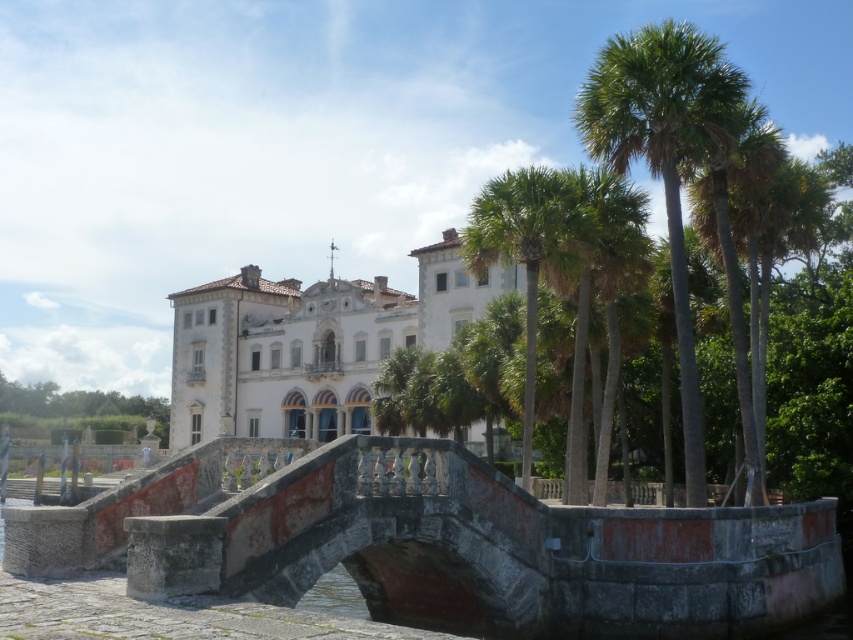
Is rustic stone bridge at center positioned at the back of white stone palace at center?

No.

Describe the element at coordinates (437, 544) in the screenshot. I see `rustic stone bridge at center` at that location.

The width and height of the screenshot is (853, 640). What do you see at coordinates (437, 544) in the screenshot?
I see `rustic stone bridge at center` at bounding box center [437, 544].

Where is `rustic stone bridge at center`? This screenshot has height=640, width=853. rustic stone bridge at center is located at coordinates (437, 544).

Consider the image. Can you confirm if rustic stone bridge at center is wider than green leafy palm trees at right?

No.

Does rustic stone bridge at center come in front of green leafy palm trees at right?

Yes, rustic stone bridge at center is closer to the viewer.

The width and height of the screenshot is (853, 640). Describe the element at coordinates (437, 544) in the screenshot. I see `rustic stone bridge at center` at that location.

Image resolution: width=853 pixels, height=640 pixels. Identify the location of rustic stone bridge at center. (437, 544).

Does point (317, 388) lie in front of point (694, 492)?

No, it is behind (694, 492).

Is white stone palace at center further to camera compared to green leafy palm trees at right?

Yes.

What do you see at coordinates (281, 355) in the screenshot?
I see `white stone palace at center` at bounding box center [281, 355].

The image size is (853, 640). In order to click on white stone palace at center in this screenshot , I will do `click(281, 355)`.